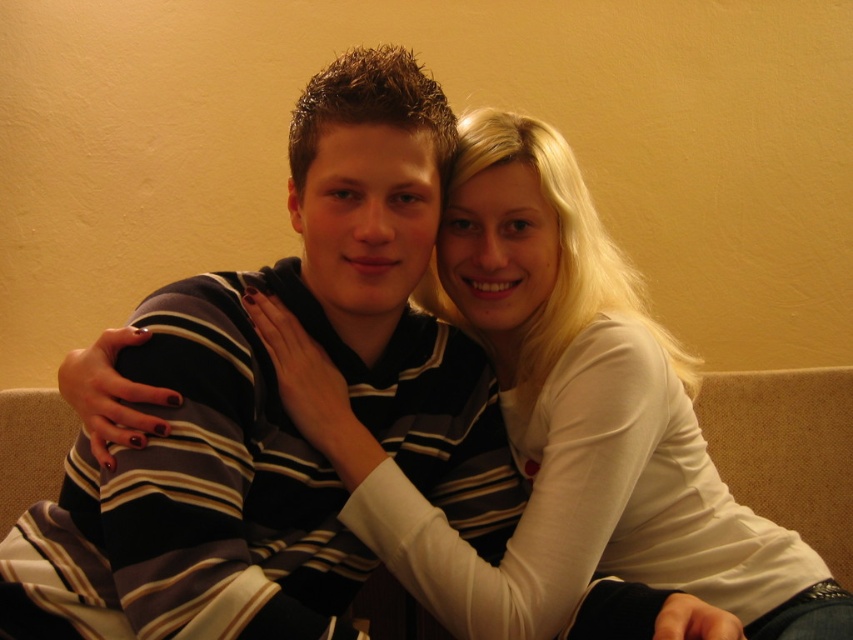
You are standing 20 inches away from the striped cotton shirt at center. If you want to take a photo of it, will you be able to capture the entire shirt in the frame without moving closer or farther?

The striped cotton shirt at center is 30.04 inches away from the camera. Since you are standing 20 inches away from the striped cotton shirt at center, you are closer than the camera. This means your distance from the shirt is shorter, so you can capture the entire shirt in the frame without needing to move closer or farther.

From the picture: You are a photographer setting up a shoot in this scene. You want to place a small prop between the striped cotton shirt at center and the white matte shirt at upper right. Based on their positions, where should you place the prop so it sits between them?

The striped cotton shirt at center is below the white matte shirt at upper right, so you should place the prop in the middle area between them, somewhere above the striped cotton shirt at center and below the white matte shirt at upper right to ensure it sits between them.

You are a photographer setting up a shoot in this living room. You need to place a small lamp between the striped cotton shirt at center and the white matte shirt at upper right. Based on their positions, where should you place the lamp?

The striped cotton shirt at center is positioned on the left side of white matte shirt at upper right, so the lamp should be placed between them, to the right of the striped cotton shirt at center and to the left of the white matte shirt at upper right.